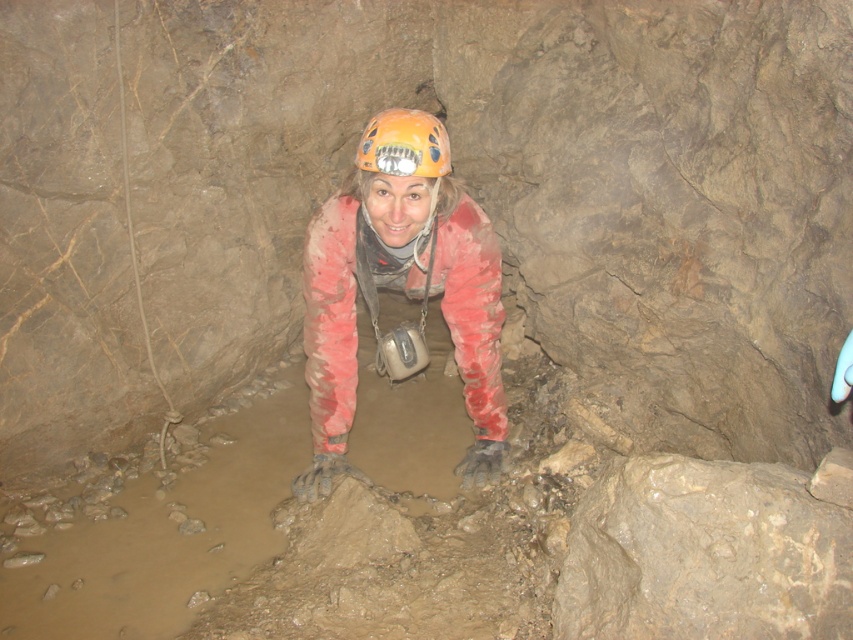
How far apart are muddy rubber boots at center and orange matte helmet at center?

They are 12.06 inches apart.

This screenshot has height=640, width=853. Identify the location of muddy rubber boots at center. (399, 288).

I want to click on muddy rubber boots at center, so click(399, 288).